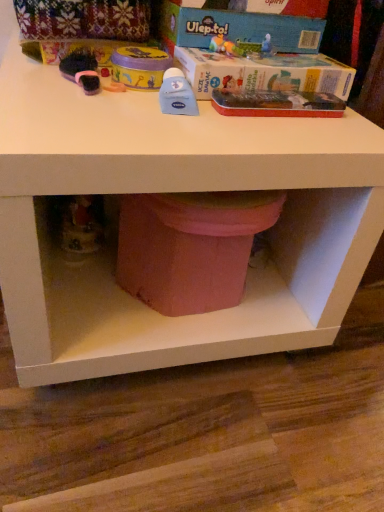
Find the location of `free space on the front side of blue cardboard box at upper center, the 2th box viewed from the top`. free space on the front side of blue cardboard box at upper center, the 2th box viewed from the top is located at coordinates (216, 128).